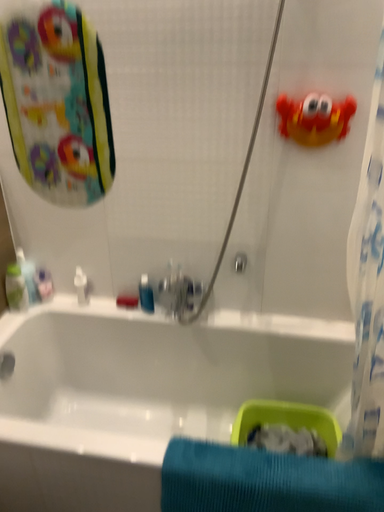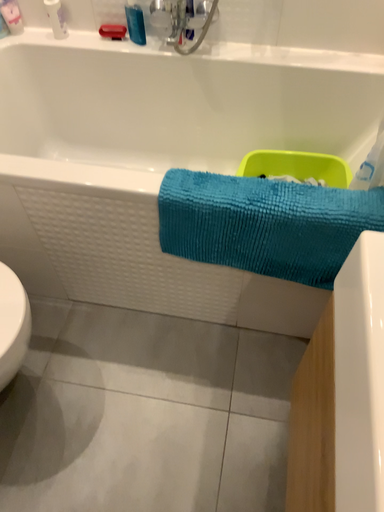
Question: Which way did the camera rotate in the video?

Choices:
 (A) rotated upward
 (B) rotated downward

Answer: (B)